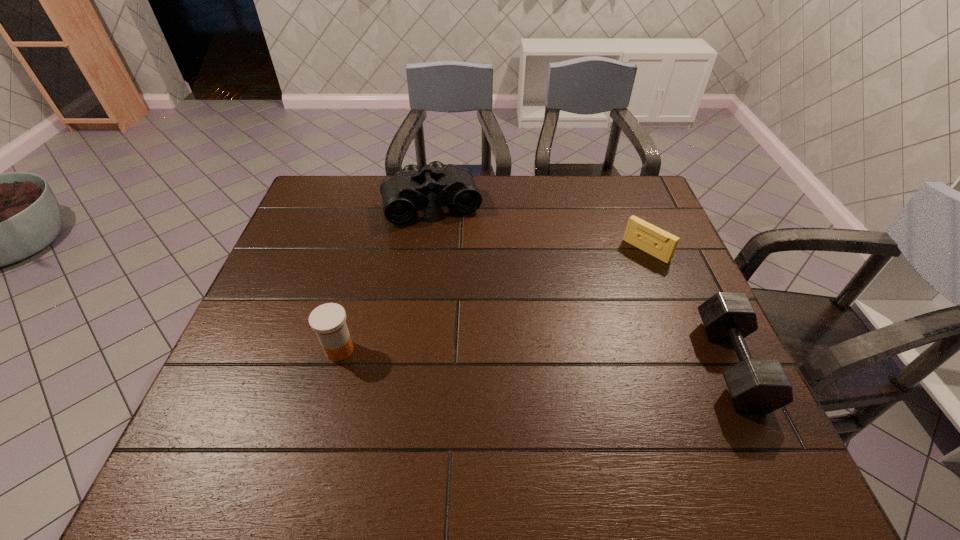
Identify the location of free space at the left edge of the desktop. This screenshot has height=540, width=960. (293, 369).

In the image, there is a desktop. At what (x,y) coordinates should I click in order to perform the action: click on vacant area at the right edge. Please return your answer as a coordinate pair (x, y). The width and height of the screenshot is (960, 540). Looking at the image, I should click on (667, 280).

Identify the location of vacant space at the far left corner. This screenshot has height=540, width=960. (322, 187).

Image resolution: width=960 pixels, height=540 pixels. In the image, there is a desktop. Identify the location of vacant space at the near left corner. (239, 386).

In the image, there is a desktop. Where is `vacant space at the far right corner`? This screenshot has width=960, height=540. vacant space at the far right corner is located at coordinates (630, 177).

Locate an element on the screen. vacant point located between the farthest object and the dumbbell is located at coordinates (582, 284).

At what (x,y) coordinates should I click in order to perform the action: click on vacant space that's between the medicine and the videotape. Please return your answer as a coordinate pair (x, y). Looking at the image, I should click on (492, 300).

This screenshot has height=540, width=960. I want to click on vacant space in between the videotape and the binoculars, so click(x=540, y=227).

Locate an element on the screen. The width and height of the screenshot is (960, 540). unoccupied area between the dumbbell and the binoculars is located at coordinates (582, 284).

This screenshot has height=540, width=960. I want to click on vacant area between the medicine and the videotape, so click(492, 300).